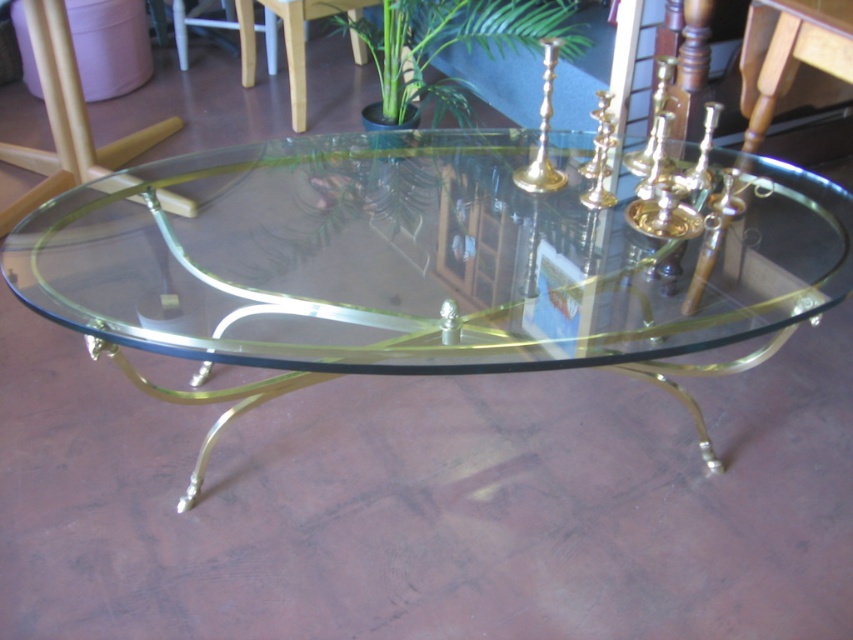
Question: Which of the following is the farthest from the observer?

Choices:
 (A) transparent glass table at center
 (B) green leafy plant at upper center

Answer: (B)

Question: Which of the following is the closest to the observer?

Choices:
 (A) (125, 236)
 (B) (451, 8)

Answer: (A)

Question: Among these points, which one is farthest from the camera?

Choices:
 (A) (641, 355)
 (B) (392, 90)

Answer: (B)

Question: Considering the relative positions of transparent glass table at center and green leafy plant at upper center in the image provided, where is transparent glass table at center located with respect to green leafy plant at upper center?

Choices:
 (A) left
 (B) right

Answer: (B)

Question: Considering the relative positions of transparent glass table at center and green leafy plant at upper center in the image provided, where is transparent glass table at center located with respect to green leafy plant at upper center?

Choices:
 (A) left
 (B) right

Answer: (B)

Question: Does transparent glass table at center appear on the left side of green leafy plant at upper center?

Choices:
 (A) no
 (B) yes

Answer: (A)